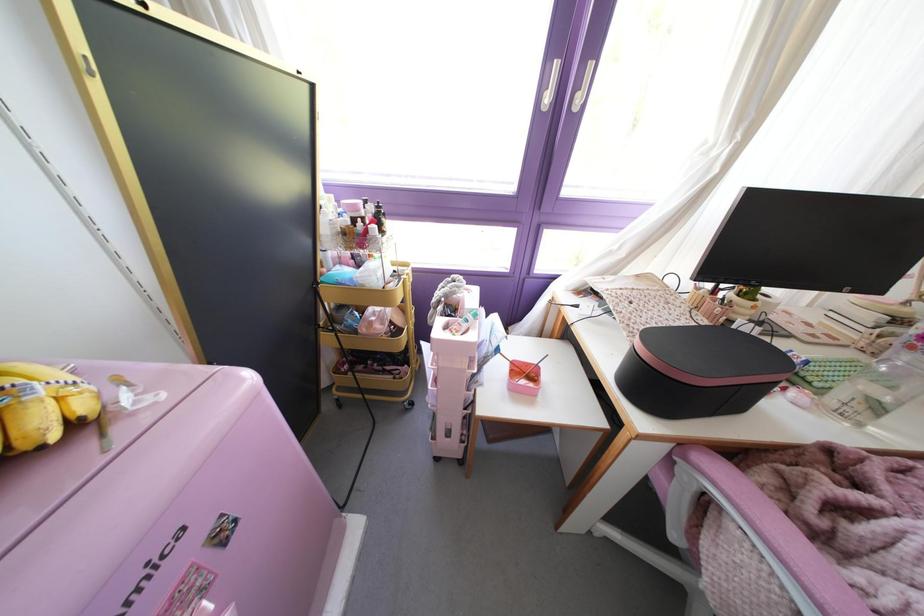
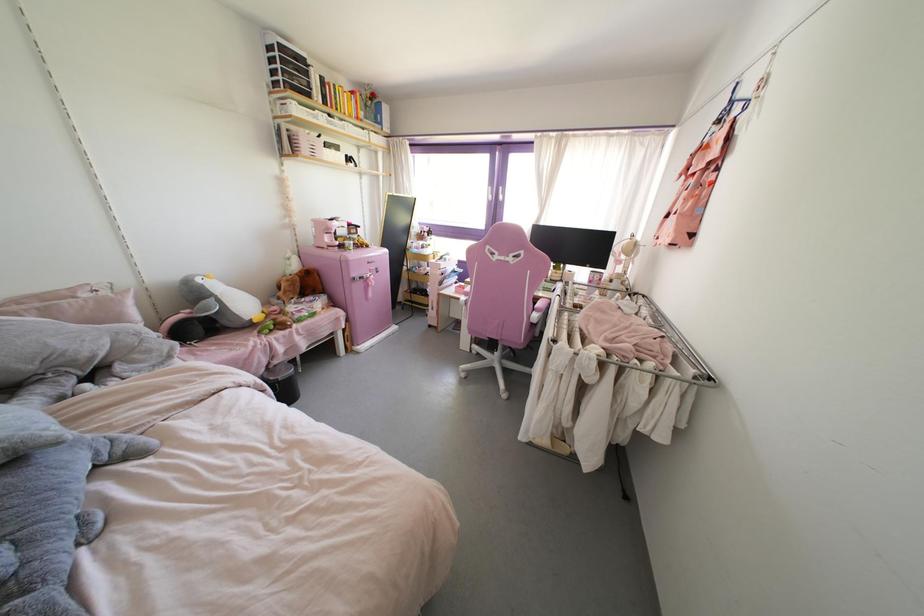
Locate, in the second image, the point that corresponds to the point at 224,541 in the first image.

(377, 272)